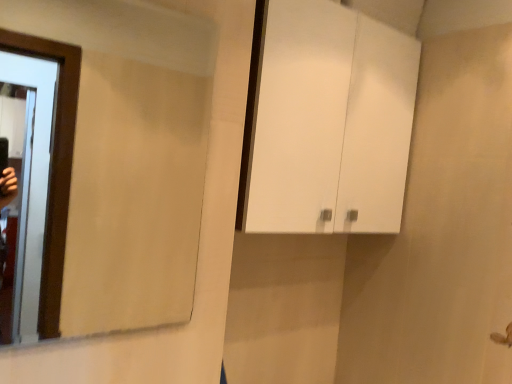
What do you see at coordinates (326, 121) in the screenshot? Image resolution: width=512 pixels, height=384 pixels. I see `white glossy cabinet at upper center` at bounding box center [326, 121].

You are a GUI agent. You are given a task and a screenshot of the screen. Output one action in this format:
    pyautogui.click(x=<x>, y=<y>)
    Task: Click on the white glossy cabinet at upper center
    The image size is (512, 384).
    Given the screenshot: What is the action you would take?
    pyautogui.click(x=326, y=121)

Locate an element on the screen. The width and height of the screenshot is (512, 384). clear glass mirror at left is located at coordinates (109, 161).

The height and width of the screenshot is (384, 512). What do you see at coordinates (109, 161) in the screenshot?
I see `clear glass mirror at left` at bounding box center [109, 161].

Locate an element on the screen. white glossy cabinet at upper center is located at coordinates (326, 121).

Can you confirm if clear glass mirror at left is positioned to the right of white glossy cabinet at upper center?

Incorrect, clear glass mirror at left is not on the right side of white glossy cabinet at upper center.

Does clear glass mirror at left lie behind white glossy cabinet at upper center?

No, the depth of clear glass mirror at left is less than that of white glossy cabinet at upper center.

Which point is more forward, (x=120, y=113) or (x=343, y=194)?

The point (x=343, y=194) is closer to the camera.

From the image's perspective, which one is positioned lower, clear glass mirror at left or white glossy cabinet at upper center?

From the image's view, clear glass mirror at left is below.

From a real-world perspective, is clear glass mirror at left physically below white glossy cabinet at upper center?

Correct, in the physical world, clear glass mirror at left is lower than white glossy cabinet at upper center.

Is clear glass mirror at left thinner than white glossy cabinet at upper center?

Indeed, clear glass mirror at left has a lesser width compared to white glossy cabinet at upper center.

In terms of height, does clear glass mirror at left look taller or shorter compared to white glossy cabinet at upper center?

clear glass mirror at left is shorter than white glossy cabinet at upper center.

Based on the photo, based on their sizes in the image, would you say clear glass mirror at left is bigger or smaller than white glossy cabinet at upper center?

In the image, clear glass mirror at left appears to be smaller than white glossy cabinet at upper center.

Would you say clear glass mirror at left contains white glossy cabinet at upper center?

No, white glossy cabinet at upper center is not inside clear glass mirror at left.

Is clear glass mirror at left directly adjacent to white glossy cabinet at upper center?

No, clear glass mirror at left is not next to white glossy cabinet at upper center.

Is clear glass mirror at left turned away from white glossy cabinet at upper center?

No, clear glass mirror at left is not facing the opposite direction of white glossy cabinet at upper center.

Measure the distance between clear glass mirror at left and white glossy cabinet at upper center.

1.10 meters.

Identify the location of mirror below the white glossy cabinet at upper center (from a real-world perspective). This screenshot has width=512, height=384. (109, 161).

Is white glossy cabinet at upper center to the right of clear glass mirror at left from the viewer's perspective?

Yes, white glossy cabinet at upper center is to the right of clear glass mirror at left.

Is the position of white glossy cabinet at upper center less distant than that of clear glass mirror at left?

No, it is not.

Which is in front, point (398, 55) or point (137, 237)?

Positioned in front is point (398, 55).

From the image's perspective, is white glossy cabinet at upper center below clear glass mirror at left?

No, from the image's perspective, white glossy cabinet at upper center is not beneath clear glass mirror at left.

From a real-world perspective, is white glossy cabinet at upper center positioned above or below clear glass mirror at left?

From a real-world perspective, white glossy cabinet at upper center is physically above clear glass mirror at left.

Between white glossy cabinet at upper center and clear glass mirror at left, which one has smaller width?

With smaller width is clear glass mirror at left.

From their relative heights in the image, would you say white glossy cabinet at upper center is taller or shorter than clear glass mirror at left?

Clearly, white glossy cabinet at upper center is taller compared to clear glass mirror at left.

In the scene shown: Based on their sizes in the image, would you say white glossy cabinet at upper center is bigger or smaller than clear glass mirror at left?

white glossy cabinet at upper center is bigger than clear glass mirror at left.

Choose the correct answer: Is white glossy cabinet at upper center inside clear glass mirror at left or outside it?

white glossy cabinet at upper center is spatially situated outside clear glass mirror at left.

Is white glossy cabinet at upper center placed right next to clear glass mirror at left?

white glossy cabinet at upper center and clear glass mirror at left are clearly separated.

Is white glossy cabinet at upper center facing towards clear glass mirror at left?

No, white glossy cabinet at upper center is not aimed at clear glass mirror at left.

Find the location of a particular element. The width and height of the screenshot is (512, 384). mirror that is below the white glossy cabinet at upper center (from the image's perspective) is located at coordinates (109, 161).

This screenshot has width=512, height=384. Find the location of `mirror in front of the white glossy cabinet at upper center`. mirror in front of the white glossy cabinet at upper center is located at coordinates (109, 161).

Locate an element on the screen. The height and width of the screenshot is (384, 512). cabinetry on the right of clear glass mirror at left is located at coordinates (326, 121).